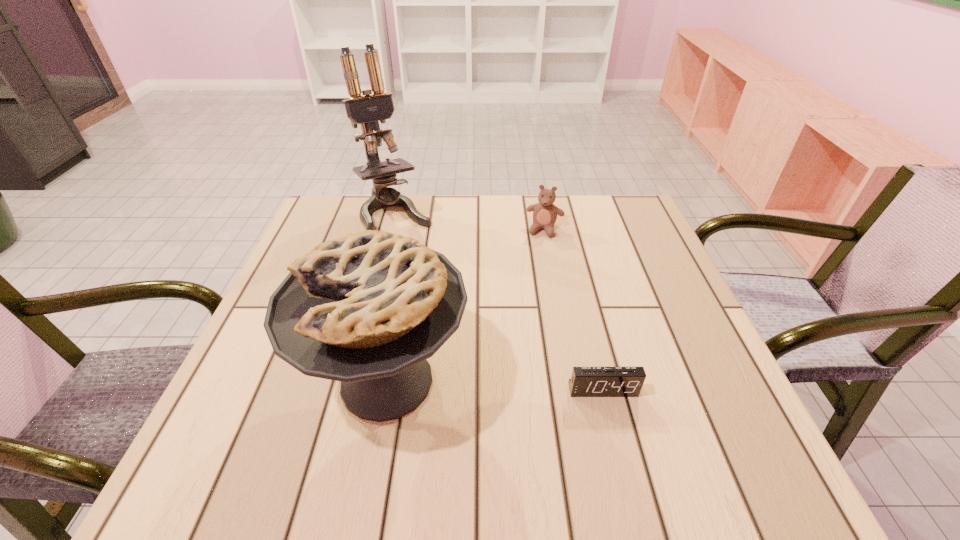
Locate an element on the screen. Image resolution: width=960 pixels, height=540 pixels. free space on the desktop that is between the pie and the alarm clock and is positioned on the front-facing side of the third tallest object is located at coordinates (502, 386).

The image size is (960, 540). Find the location of `vacant space on the desktop that is between the second tallest object and the alarm clock and is positioned at the eyepieces of the microscope`. vacant space on the desktop that is between the second tallest object and the alarm clock and is positioned at the eyepieces of the microscope is located at coordinates (500, 386).